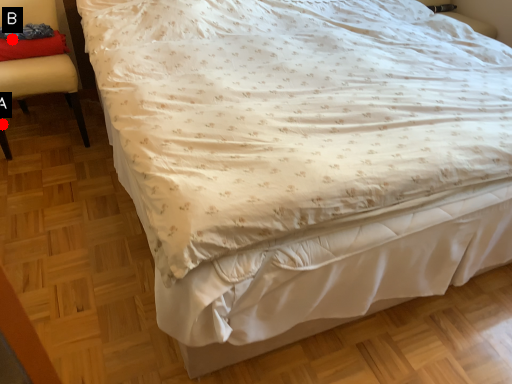
Question: Two points are circled on the image, labeled by A and B beside each circle. Which point is closer to the camera?

Choices:
 (A) A is closer
 (B) B is closer

Answer: (B)